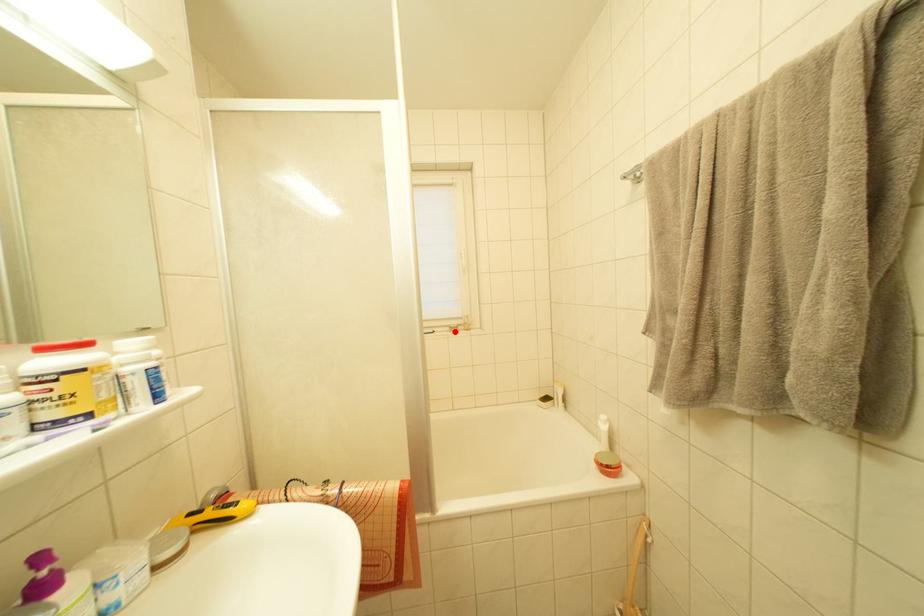
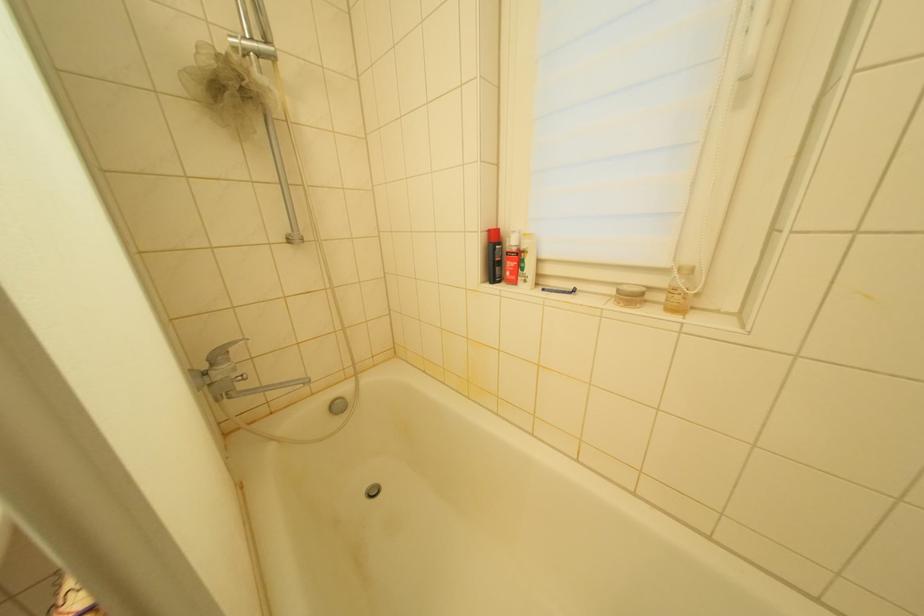
Find the pixel in the second image that matches the highlighted location in the first image.

(623, 294)